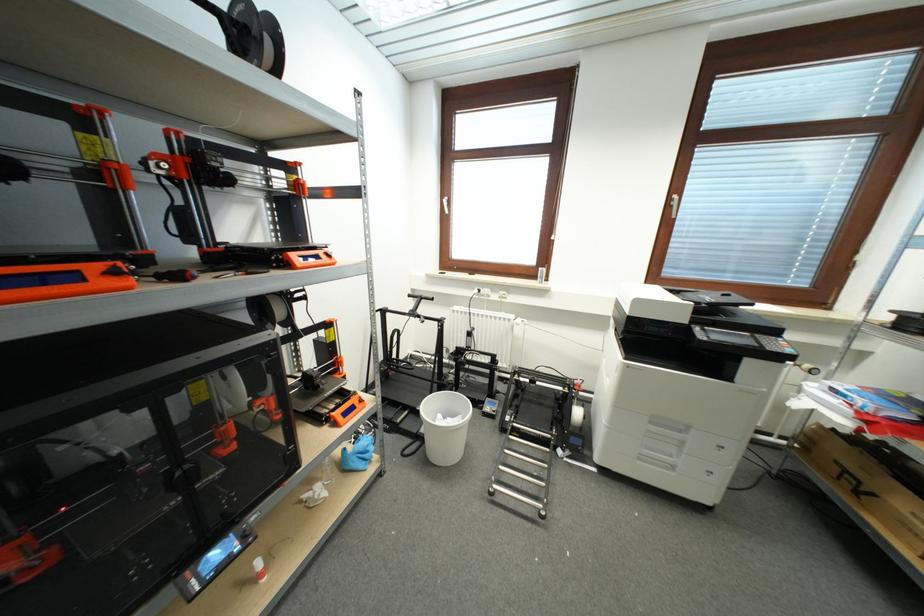
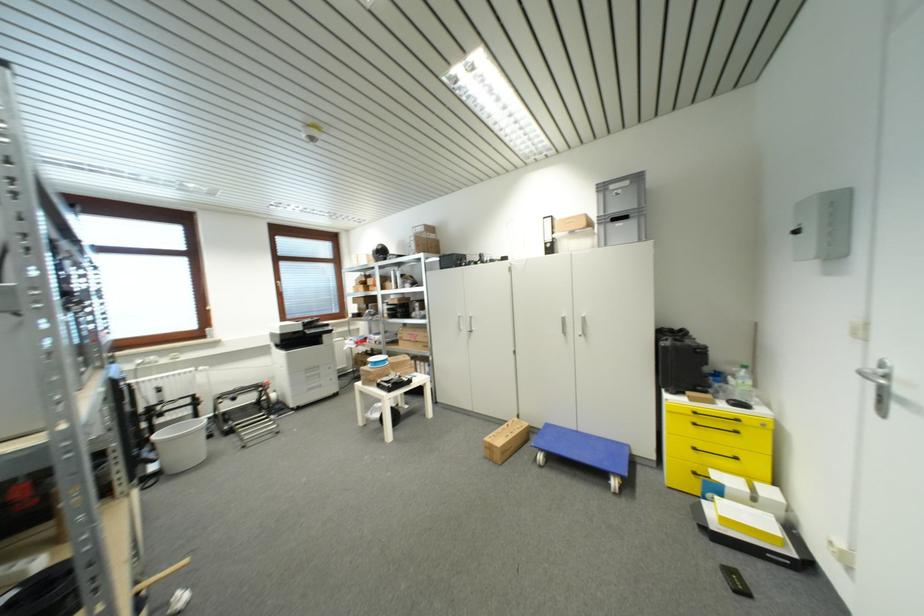
In the second image, find the point that corresponds to the point at 739,301 in the first image.

(320, 321)